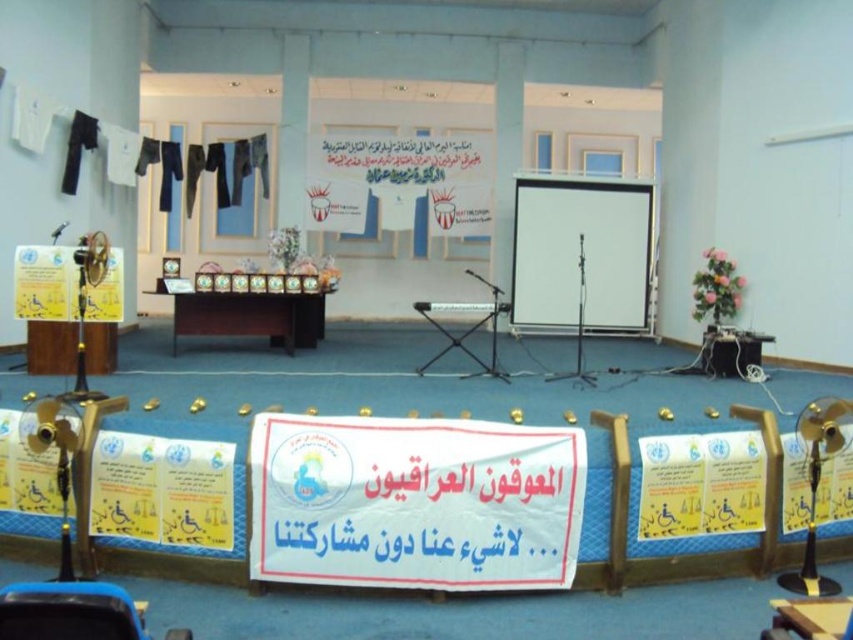
Question: From the image, what is the correct spatial relationship of white matte projection screen at center in relation to wooden podium at center?

Choices:
 (A) above
 (B) below

Answer: (A)

Question: Does white matte projection screen at center lie in front of wooden podium at center?

Choices:
 (A) yes
 (B) no

Answer: (B)

Question: In this image, where is white matte projection screen at center located relative to wooden podium at center?

Choices:
 (A) below
 (B) above

Answer: (B)